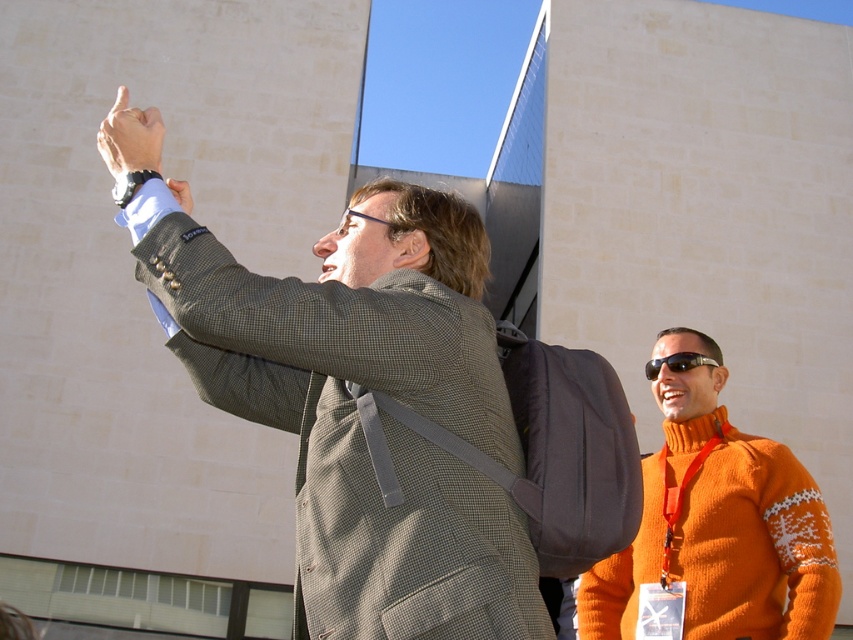
Identify the location of orange knitted sweater at right. (717, 525).

Is orange knitted sweater at right positioned before black plastic sunglasses at upper right?

Yes, orange knitted sweater at right is closer to the viewer.

At what (x,y) coordinates should I click in order to perform the action: click on orange knitted sweater at right. Please return your answer as a coordinate pair (x, y). This screenshot has width=853, height=640. Looking at the image, I should click on (717, 525).

Can you confirm if orange knitted sweater at right is positioned above matte black wristwatch at upper left?

Actually, orange knitted sweater at right is below matte black wristwatch at upper left.

Between orange knitted sweater at right and matte black wristwatch at upper left, which one appears on the right side from the viewer's perspective?

From the viewer's perspective, orange knitted sweater at right appears more on the right side.

Is point (585, 580) closer to viewer compared to point (117, 108)?

No, it is behind (117, 108).

Locate an element on the screen. The height and width of the screenshot is (640, 853). orange knitted sweater at right is located at coordinates (717, 525).

This screenshot has width=853, height=640. What do you see at coordinates (357, 410) in the screenshot?
I see `matte gray blazer at upper left` at bounding box center [357, 410].

I want to click on matte gray blazer at upper left, so click(357, 410).